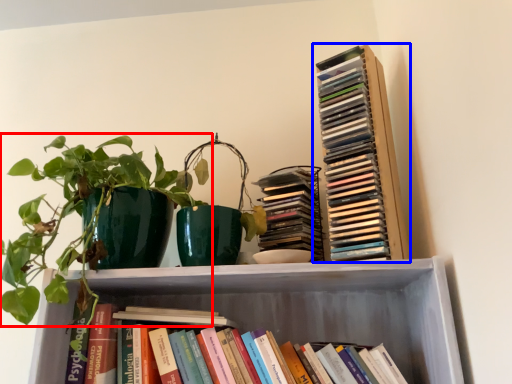
Question: Which object is closer to the camera taking this photo, houseplant (highlighted by a red box) or book (highlighted by a blue box)?

Choices:
 (A) houseplant
 (B) book

Answer: (A)